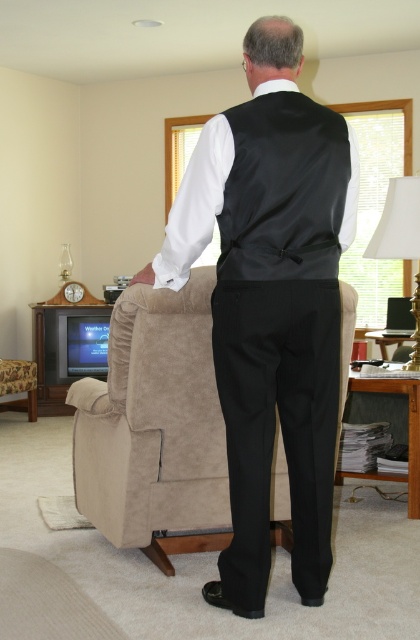
Question: Is satin black vest at center wider than black satin vest at center?

Choices:
 (A) yes
 (B) no

Answer: (A)

Question: Which object is the closest to the black satin vest at center?

Choices:
 (A) suede armchair at center
 (B) white fabric lampshade at upper right
 (C) satin black vest at center

Answer: (C)

Question: Can you confirm if satin black vest at center is bigger than white fabric lampshade at upper right?

Choices:
 (A) no
 (B) yes

Answer: (B)

Question: Considering the real-world distances, which object is closest to the black satin vest at center?

Choices:
 (A) suede armchair at center
 (B) white fabric lampshade at upper right
 (C) satin black vest at center

Answer: (C)

Question: Which point is farther from the camera taking this photo?

Choices:
 (A) (236, 172)
 (B) (327, 228)

Answer: (B)

Question: Can you confirm if black satin vest at center is positioned to the right of white fabric lampshade at upper right?

Choices:
 (A) yes
 (B) no

Answer: (B)